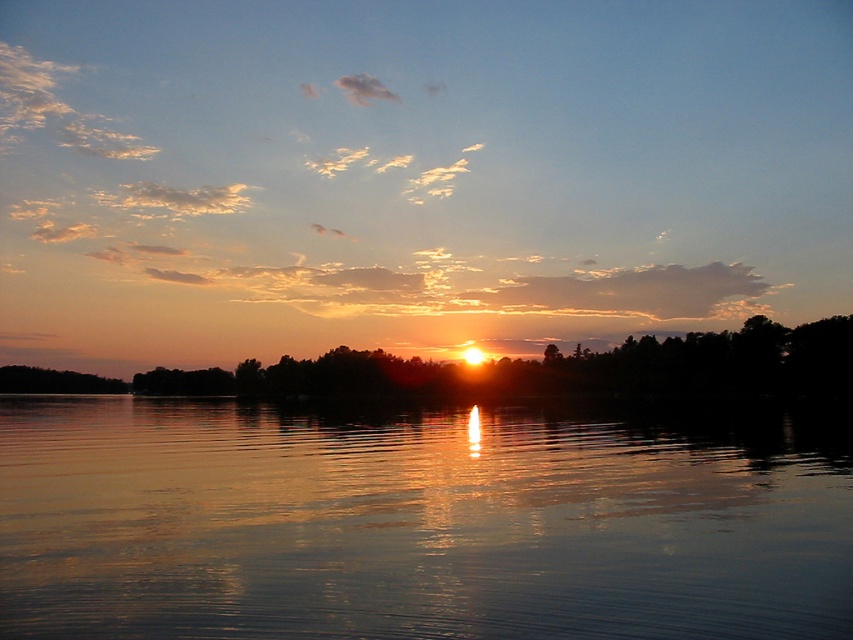
You are a photographer trying to capture the sunset reflection on the water. You notice the glistening water at center and the silky black trees at center. Which object is positioned higher in the image?

The glistening water at center is located above the silky black trees at center, so it is positioned higher in the image.